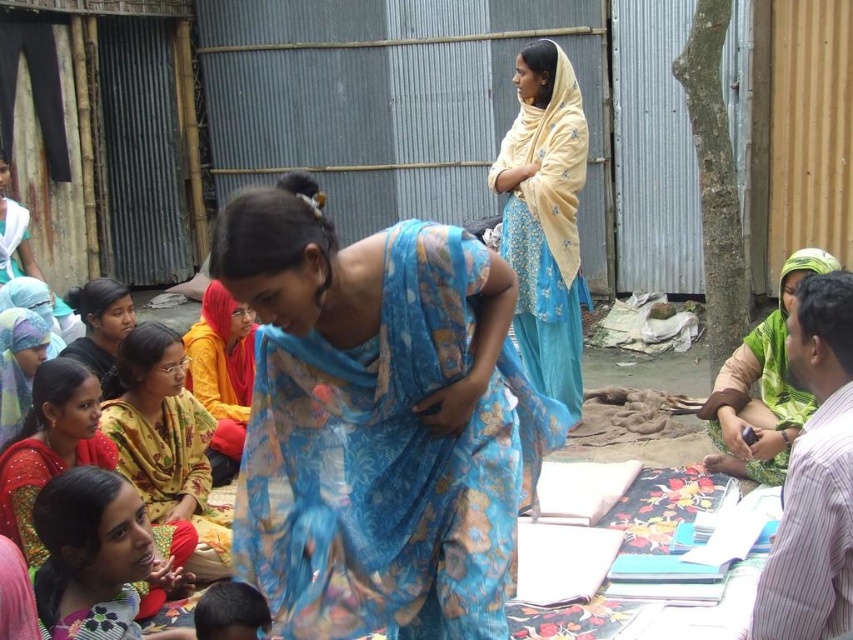
You are attending an outdoor gathering and notice two items of clothing, the yellow printed fabric at lower left and the green textured saree at right. Which one is nearer to you?

The yellow printed fabric at lower left is closer to the viewer than the green textured saree at right.